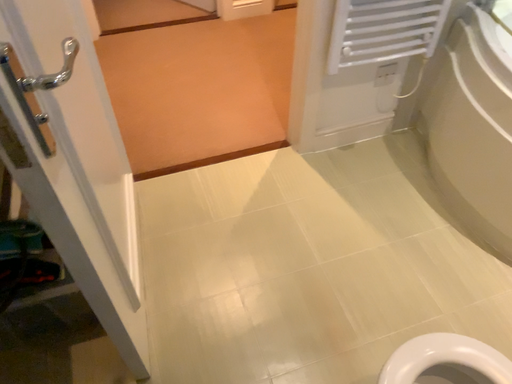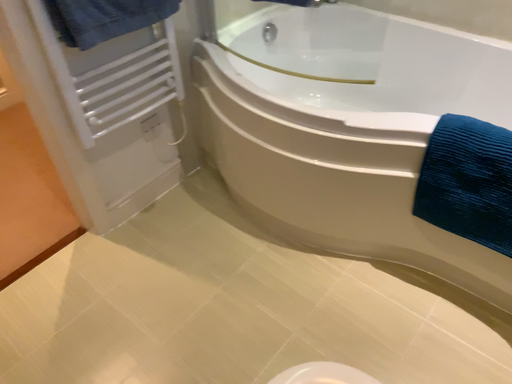
Question: How did the camera likely rotate when shooting the video?

Choices:
 (A) rotated right
 (B) rotated left

Answer: (A)